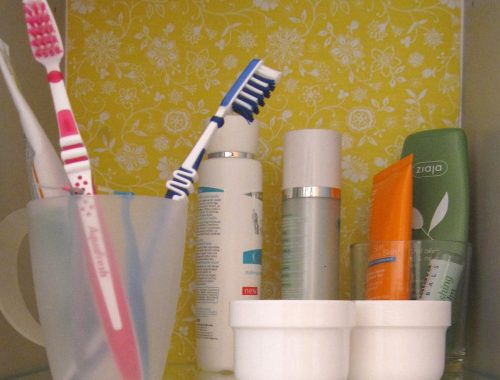
Locate an element on the screen. This screenshot has height=380, width=500. 2 clear cups is located at coordinates (56, 277), (454, 268).